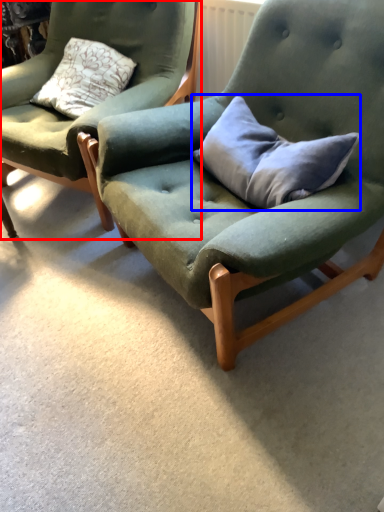
Question: Which object is closer to the camera taking this photo, chair (highlighted by a red box) or pillow (highlighted by a blue box)?

Choices:
 (A) chair
 (B) pillow

Answer: (B)